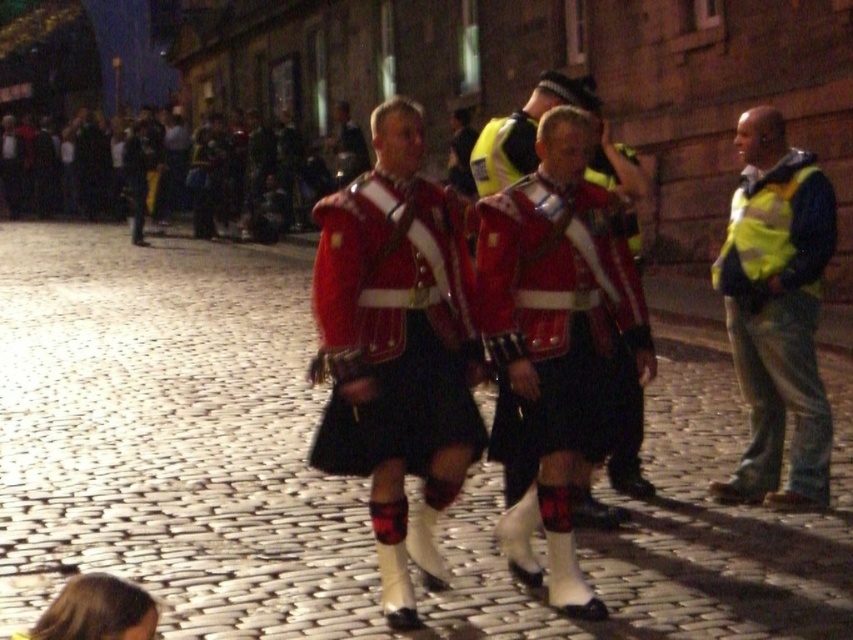
Question: Observing the image, what is the correct spatial positioning of yellow reflective vest at right in reference to red velvet kilt at center?

Choices:
 (A) below
 (B) above

Answer: (B)

Question: Considering the relative positions of yellow reflective vest at right and red velvet kilt at center in the image provided, where is yellow reflective vest at right located with respect to red velvet kilt at center?

Choices:
 (A) right
 (B) left

Answer: (A)

Question: Among these points, which one is nearest to the camera?

Choices:
 (A) coord(625,243)
 (B) coord(778,353)
 (C) coord(396,536)

Answer: (C)

Question: Which point is farther from the camera taking this photo?

Choices:
 (A) (621, 374)
 (B) (323, 458)

Answer: (A)

Question: From the image, what is the correct spatial relationship of red woolen kilt at center in relation to red velvet kilt at center?

Choices:
 (A) left
 (B) right

Answer: (A)

Question: Which object is positioned closest to the red velvet kilt at center?

Choices:
 (A) red woolen kilt at center
 (B) yellow reflective vest at right

Answer: (A)